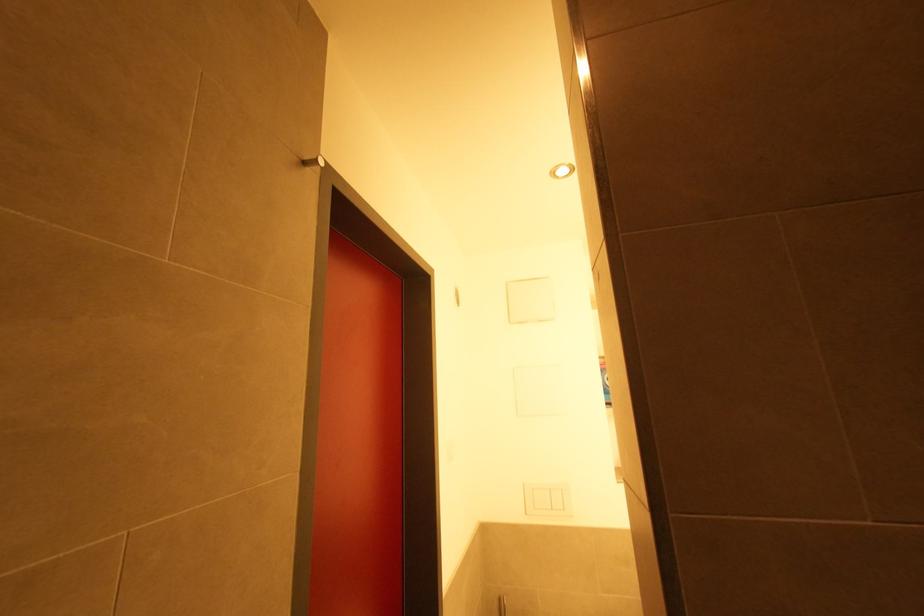
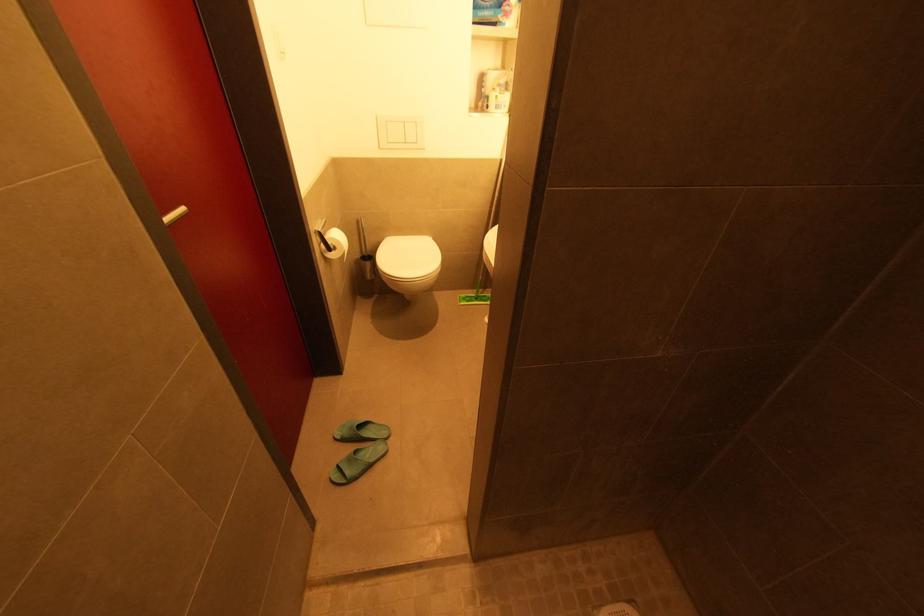
How did the camera likely rotate?

The rotation direction of the camera is right-down.